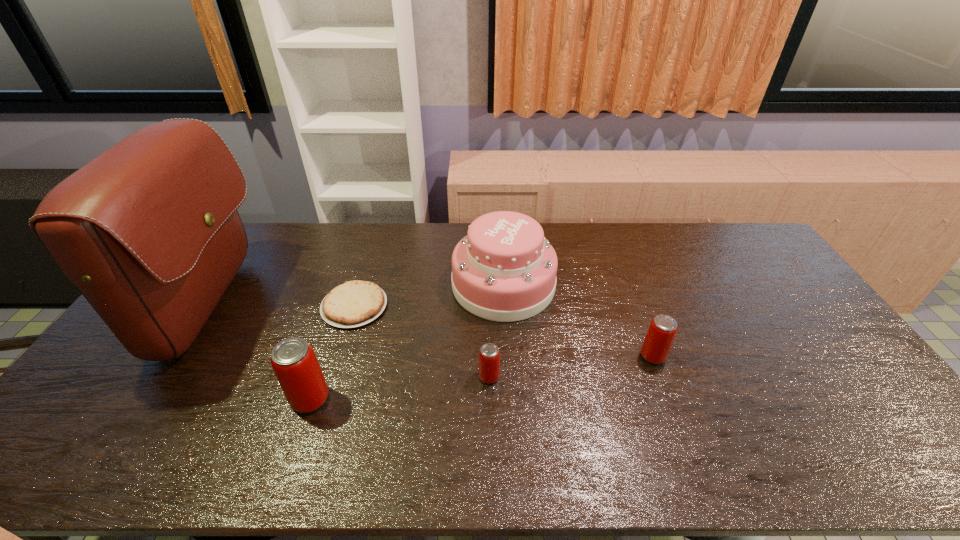
Locate an element on the screen. This screenshot has width=960, height=540. object at the far left corner is located at coordinates (148, 231).

This screenshot has width=960, height=540. Identify the location of free space at the far edge of the desktop. (724, 260).

Where is `vacant region at the near edge of the desktop`? This screenshot has width=960, height=540. vacant region at the near edge of the desktop is located at coordinates (355, 399).

Locate an element on the screen. Image resolution: width=960 pixels, height=540 pixels. vacant space at the right edge is located at coordinates (738, 279).

In the image, there is a desktop. At what (x,y) coordinates should I click in order to perform the action: click on vacant space at the far right corner. Please return your answer as a coordinate pair (x, y). Looking at the image, I should click on (720, 240).

Image resolution: width=960 pixels, height=540 pixels. In order to click on blank region between the tallest object and the second tallest beer can in this screenshot , I will do `click(432, 332)`.

You are a GUI agent. You are given a task and a screenshot of the screen. Output one action in this format:
    pyautogui.click(x=<x>, y=<y>)
    Task: Click on the vacant area that lies between the leftmost object and the leftmost beer can
    The image size is (960, 540).
    Given the screenshot: What is the action you would take?
    pyautogui.click(x=260, y=353)

The width and height of the screenshot is (960, 540). I want to click on free space that is in between the fourth tallest object and the shortest object, so click(x=504, y=331).

The image size is (960, 540). In order to click on vacant area between the fifth tallest object and the rightmost object in this screenshot , I will do `click(571, 366)`.

The height and width of the screenshot is (540, 960). Identify the location of free spot between the second tallest object and the shortest object. (429, 296).